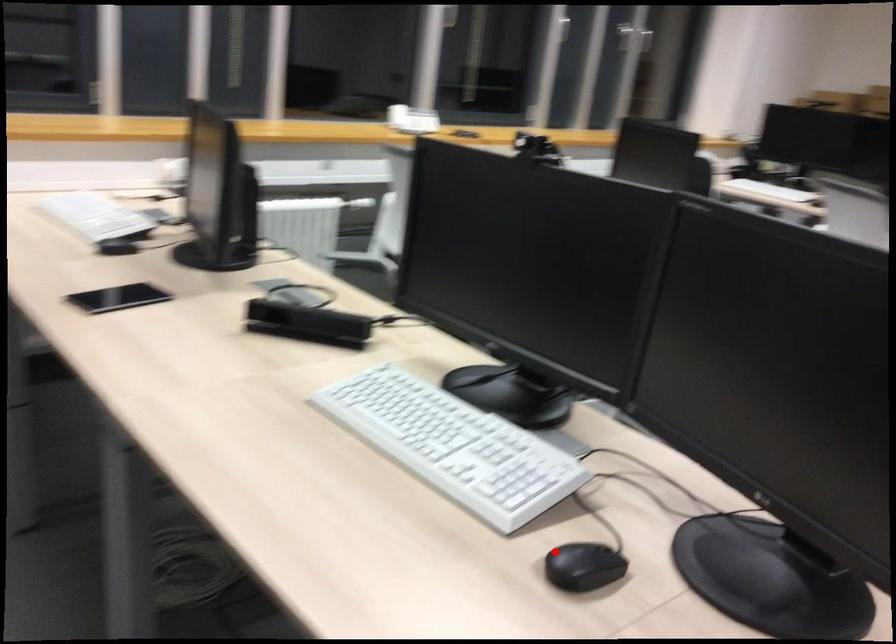
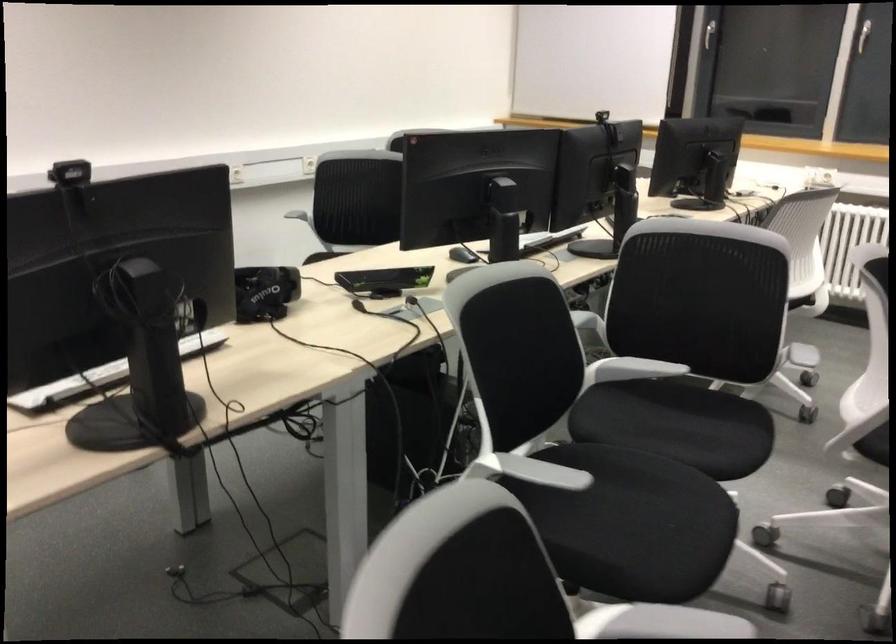
Question: I am providing you with two images of the same scene from different viewpoints. Image1 has a red point marked. In image2, the corresponding 3D location appears at what relative position? Reply with the corresponding letter.

Choices:
 (A) Closer
 (B) Farther

Answer: (B)